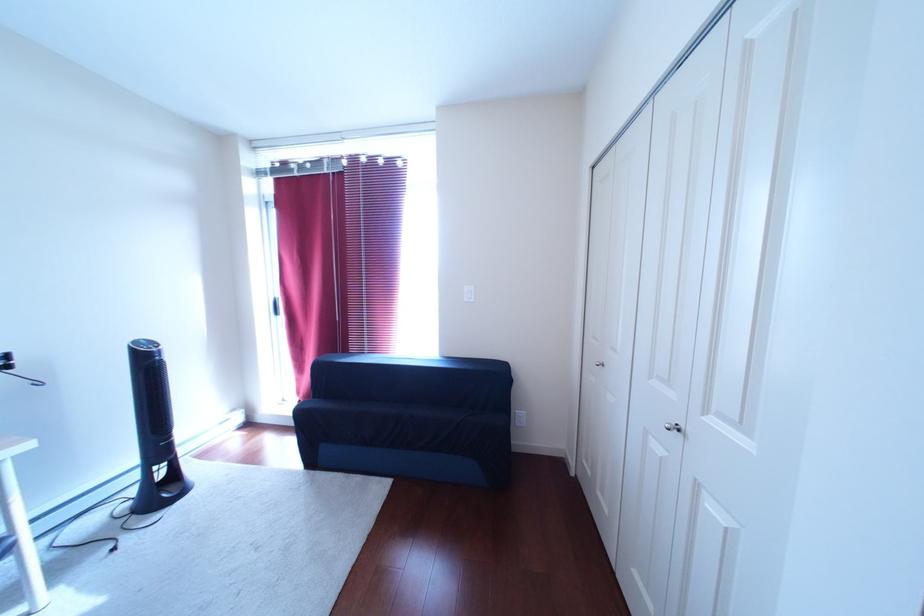
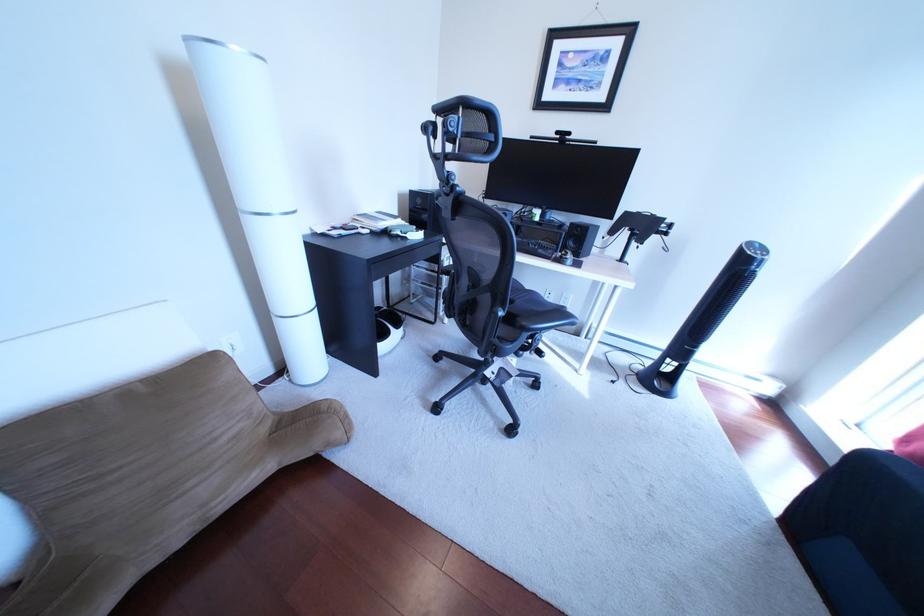
The images are taken continuously from a first-person perspective. In which direction is your viewpoint rotating?

The camera's rotation is toward left-down.